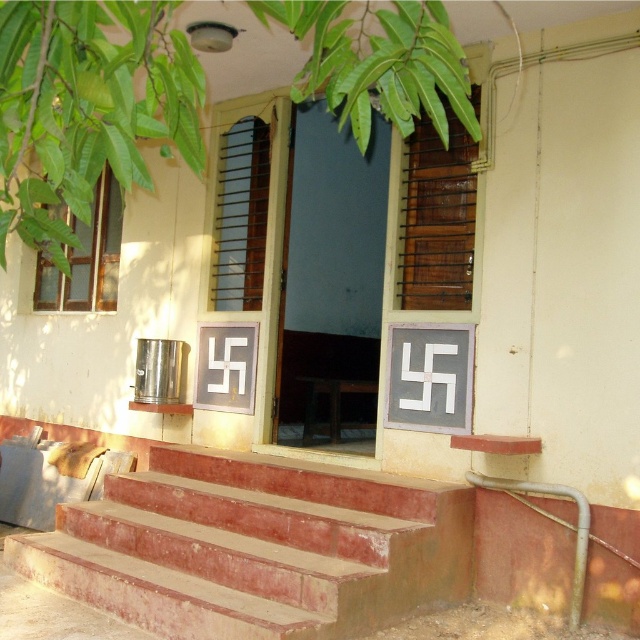
You are a delivery person with a cart that is 1.8 meters wide. You need to move the cart from the street to the entrance. Is there enough space between the smooth concrete stairs at center and the brown wooden shutter at upper center to pass through?

The distance between the smooth concrete stairs at center and the brown wooden shutter at upper center is 2.10 meters. Since the cart is 1.8 meters wide, there is sufficient space to pass through as the distance is greater than the cart width.

You are standing at the entrance of the building and want to place a small potted plant exactly at point (256, 548). Based on the scene description, where would this point be located?

The point (256, 548) is located on the smooth concrete stairs at center.

You are a delivery person with a large box that needs to be carried up the stairs. Based on the scene, can you determine if the smooth concrete stairs at center are wide enough to accommodate both you and the brown wooden shutter at center if you were to carry the box up them together?

The smooth concrete stairs at center are larger in size compared to the brown wooden shutter at center, so there should be enough space to carry the box up the stairs while also accommodating the shutter.